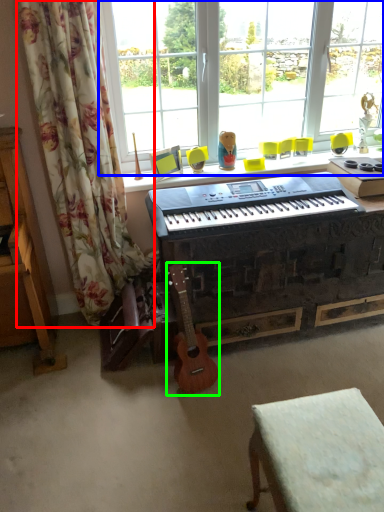
Question: Based on their relative distances, which object is farther from curtain (highlighted by a red box)? Choose from window screen (highlighted by a blue box) and guitar (highlighted by a green box).

Choices:
 (A) window screen
 (B) guitar

Answer: (A)